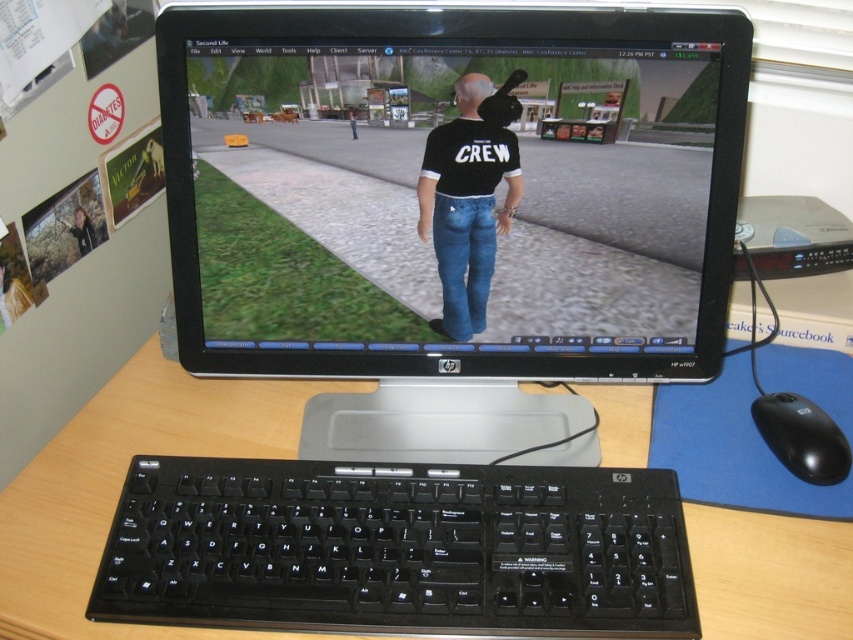
You are setting up a new computer desk and want to place both the black plastic monitor at center and the black plastic keyboard at lower center on the desk. Based on their sizes, which object should you place first to ensure proper positioning?

The black plastic monitor at center is much taller than the black plastic keyboard at lower center, so you should place the black plastic monitor at center first to ensure it doesn not block the keyboard.

From the picture: You are setting up a new desk layout and want to place both the black plastic keyboard at lower center and the wooden at center on the desk. Which item takes up more desk space?

The wooden at center takes up more desk space than the black plastic keyboard at lower center because the black plastic keyboard at lower center occupies less space than wooden at center.